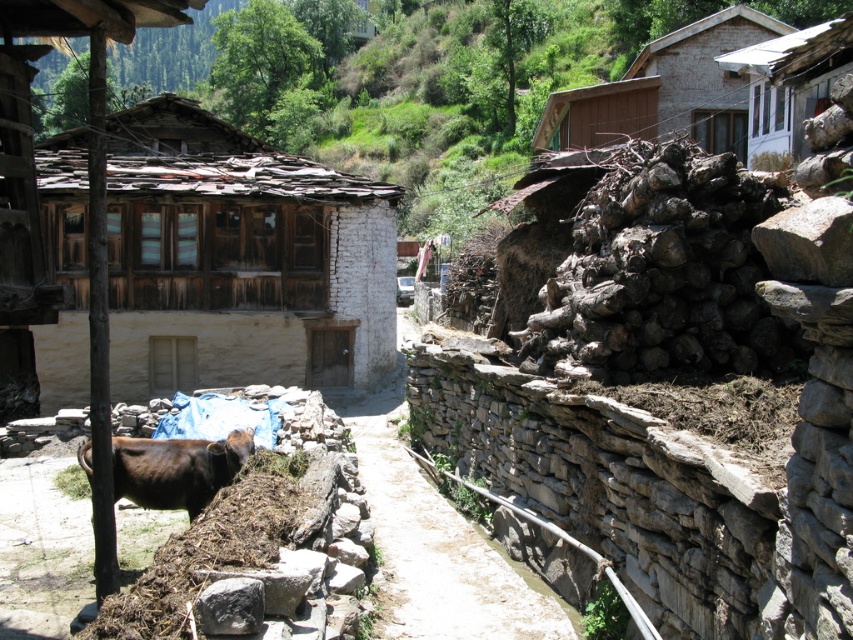
Question: Does weathered wood hut at left have a greater width compared to gray rough stone at lower center?

Choices:
 (A) yes
 (B) no

Answer: (A)

Question: Which point is closer to the camera taking this photo?

Choices:
 (A) (239, 592)
 (B) (207, 500)
 (C) (726, 129)

Answer: (A)

Question: Estimate the real-world distances between objects in this image. Which object is farther from the brown furry yak at lower left?

Choices:
 (A) gray rough stone at lower center
 (B) dirt path at center

Answer: (A)

Question: From the image, what is the correct spatial relationship of weathered wood hut at left in relation to brown wooden hut at upper right?

Choices:
 (A) left
 (B) right

Answer: (A)

Question: Does brown furry yak at lower left appear over gray rough stone at lower center?

Choices:
 (A) yes
 (B) no

Answer: (A)

Question: Which of the following is the closest to the observer?

Choices:
 (A) (218, 609)
 (B) (734, 45)
 (C) (172, 508)
 (D) (374, 506)

Answer: (A)